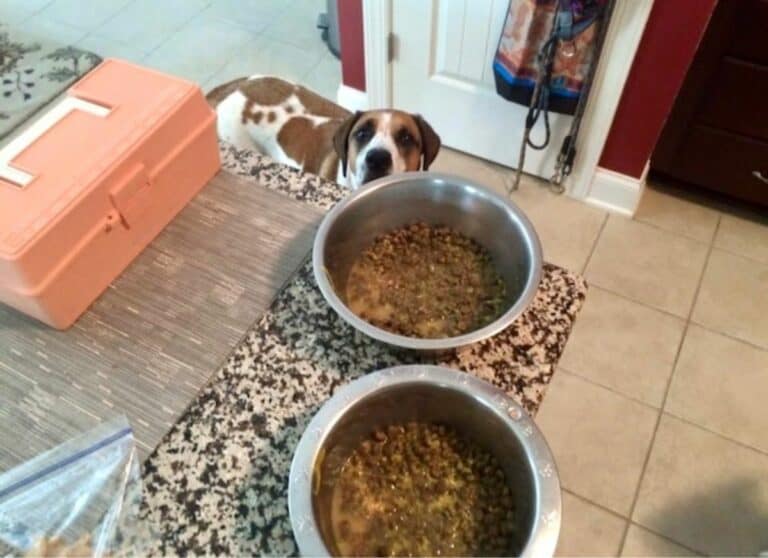
Where is `black and white marble table top`? Image resolution: width=768 pixels, height=558 pixels. black and white marble table top is located at coordinates (280, 418).